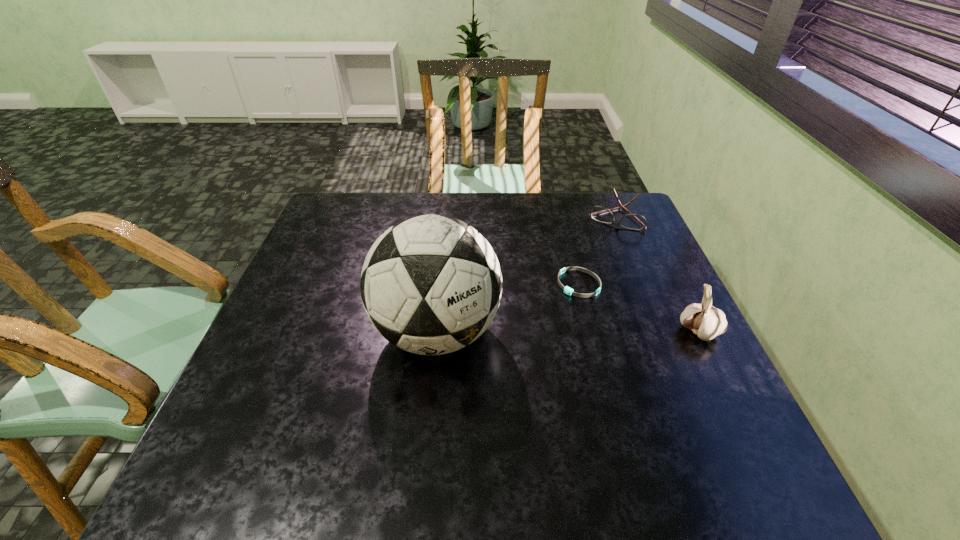
In the image, there is a desktop. Where is `vacant space at the left edge`? This screenshot has height=540, width=960. vacant space at the left edge is located at coordinates (299, 273).

Find the location of a particular element. This screenshot has height=540, width=960. vacant region at the right edge of the desktop is located at coordinates (660, 292).

The image size is (960, 540). In order to click on free space between the second object from left to right and the garlic in this screenshot , I will do `click(638, 308)`.

Where is `vacant point located between the leftmost object and the shortest object`? This screenshot has height=540, width=960. vacant point located between the leftmost object and the shortest object is located at coordinates (508, 308).

Locate an element on the screen. This screenshot has height=540, width=960. free space between the third object from right to left and the tallest object is located at coordinates (508, 308).

Image resolution: width=960 pixels, height=540 pixels. I want to click on vacant area between the farthest object and the third shortest object, so click(657, 274).

Image resolution: width=960 pixels, height=540 pixels. I want to click on empty space that is in between the spectacles and the shortest object, so click(597, 250).

The height and width of the screenshot is (540, 960). I want to click on empty location between the leftmost object and the wristband, so click(x=508, y=308).

Find the location of a particular element. The height and width of the screenshot is (540, 960). free space between the wristband and the spectacles is located at coordinates (597, 250).

Locate an element on the screen. unoccupied position between the spectacles and the shortest object is located at coordinates (597, 250).